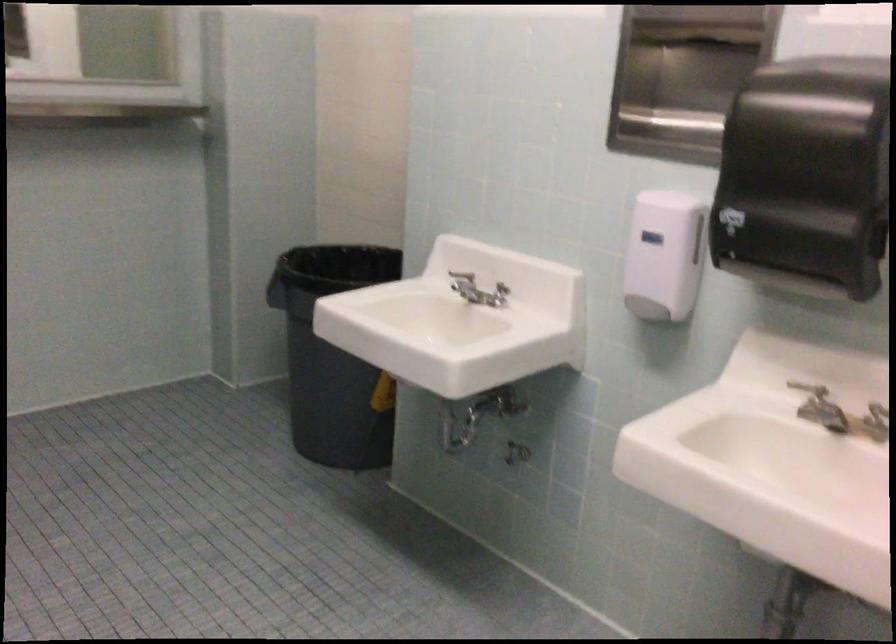
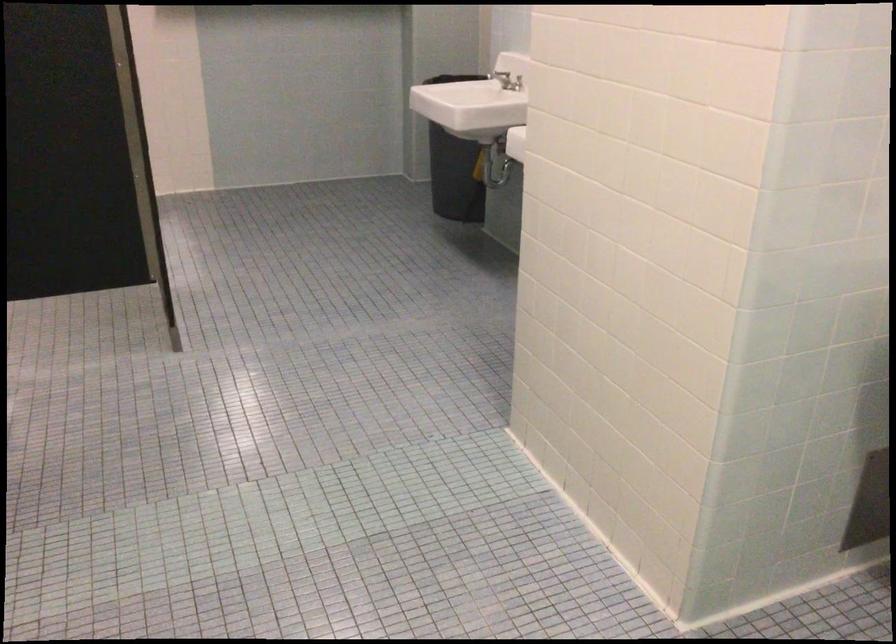
Question: I am providing you with two images of the same scene from different viewpoints. After the viewpoint changes to image2, which objects are now occluded?

Choices:
 (A) pump dispenser head
 (B) metal faucet handle
 (C) dark trash can
 (D) faucet handle

Answer: (D)